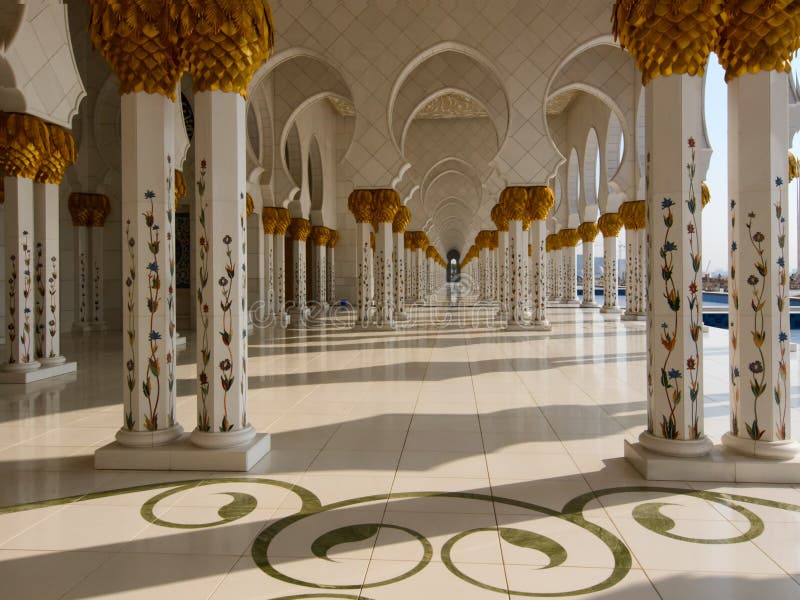
Where is `light brown ceiling`? light brown ceiling is located at coordinates click(x=444, y=102).